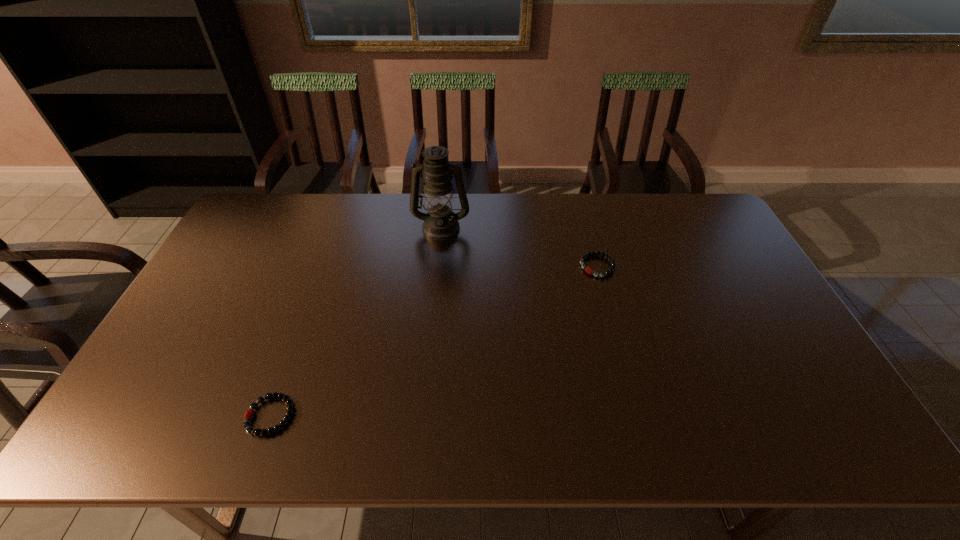
Find the location of a particular element. vacant area that satisfies the following two spatial constraints: 1. on the back side of the farthest object; 2. on the left side of the left bracelet is located at coordinates (339, 227).

Image resolution: width=960 pixels, height=540 pixels. I want to click on free space that satisfies the following two spatial constraints: 1. on the back side of the rightmost object; 2. on the right side of the nearest object, so click(x=324, y=266).

I want to click on free space that satisfies the following two spatial constraints: 1. on the back side of the left bracelet; 2. on the right side of the farther bracelet, so click(x=324, y=266).

Identify the location of blank area in the image that satisfies the following two spatial constraints: 1. on the back side of the second nearest object; 2. on the right side of the left bracelet. (324, 266).

Image resolution: width=960 pixels, height=540 pixels. In order to click on vacant area in the image that satisfies the following two spatial constraints: 1. on the front side of the rightmost object; 2. on the right side of the second object from left to right in this screenshot , I will do [438, 266].